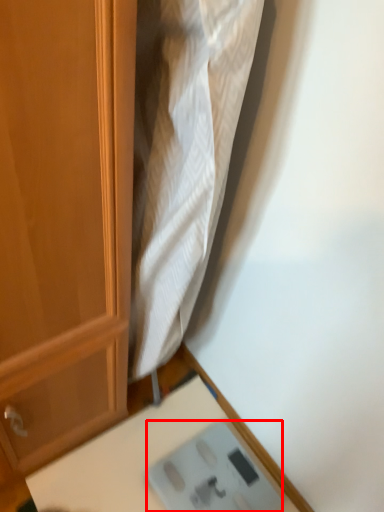
Question: From the image, what is the correct spatial relationship of scale (annotated by the red box) in relation to table?

Choices:
 (A) right
 (B) left

Answer: (A)